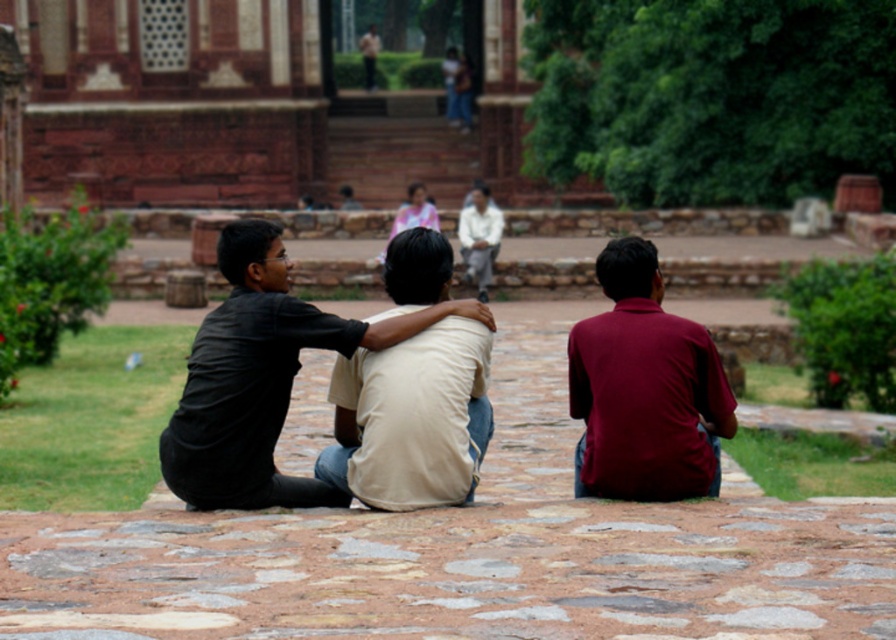
Describe the element at coordinates (261, 378) in the screenshot. I see `matte black shirt at center` at that location.

Is point (253, 378) less distant than point (586, 320)?

That is True.

Where is `matte black shirt at center`? matte black shirt at center is located at coordinates (261, 378).